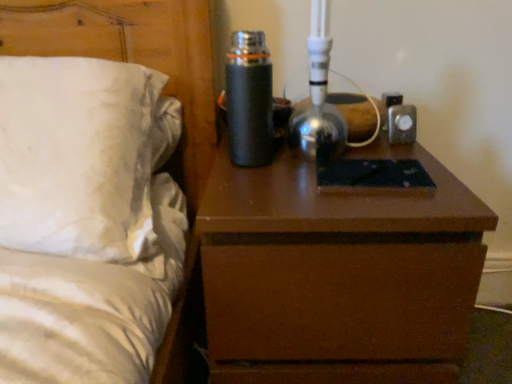
Question: Is brown matte nightstand at center not within black matte thermos at upper center?

Choices:
 (A) no
 (B) yes

Answer: (B)

Question: Would you say brown matte nightstand at center contains black matte thermos at upper center?

Choices:
 (A) yes
 (B) no

Answer: (B)

Question: Is brown matte nightstand at center taller than black matte thermos at upper center?

Choices:
 (A) yes
 (B) no

Answer: (A)

Question: Does brown matte nightstand at center have a smaller size compared to black matte thermos at upper center?

Choices:
 (A) yes
 (B) no

Answer: (B)

Question: Does brown matte nightstand at center appear on the right side of black matte thermos at upper center?

Choices:
 (A) no
 (B) yes

Answer: (B)

Question: From the image's perspective, is brown matte nightstand at center positioned above or below white satin bed at left?

Choices:
 (A) below
 (B) above

Answer: (A)

Question: From a real-world perspective, is brown matte nightstand at center physically located above or below white satin bed at left?

Choices:
 (A) above
 (B) below

Answer: (B)

Question: Choose the correct answer: Is brown matte nightstand at center inside white satin bed at left or outside it?

Choices:
 (A) inside
 (B) outside

Answer: (B)

Question: Is brown matte nightstand at center bigger or smaller than white satin bed at left?

Choices:
 (A) big
 (B) small

Answer: (B)

Question: From a real-world perspective, relative to white satin bed at left, is black matte thermos at upper center vertically above or below?

Choices:
 (A) below
 (B) above

Answer: (B)

Question: Is black matte thermos at upper center wider or thinner than white satin bed at left?

Choices:
 (A) thin
 (B) wide

Answer: (A)

Question: In the image, is black matte thermos at upper center positioned in front of or behind white satin bed at left?

Choices:
 (A) behind
 (B) front

Answer: (A)

Question: Based on their positions, is black matte thermos at upper center located to the left or right of white satin bed at left?

Choices:
 (A) left
 (B) right

Answer: (B)

Question: Is white satin bed at left inside the boundaries of brown matte nightstand at center, or outside?

Choices:
 (A) inside
 (B) outside

Answer: (B)

Question: Considering the positions of white satin bed at left and brown matte nightstand at center in the image, is white satin bed at left wider or thinner than brown matte nightstand at center?

Choices:
 (A) wide
 (B) thin

Answer: (B)